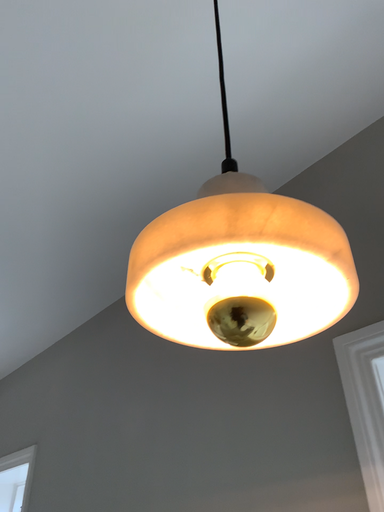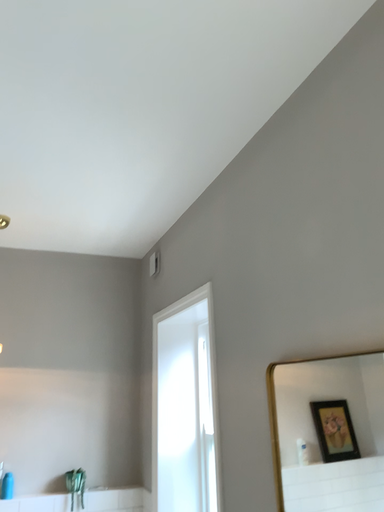
Question: Which way did the camera rotate in the video?

Choices:
 (A) rotated left
 (B) rotated right

Answer: (A)